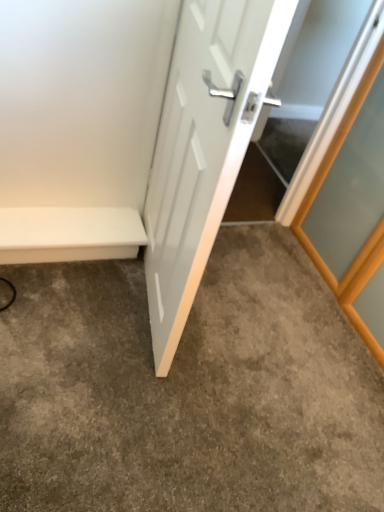
At what (x,y) coordinates should I click in order to perform the action: click on vacant space in white glossy door at center (from a real-world perspective). Please return your answer as a coordinate pair (x, y). Looking at the image, I should click on (144, 300).